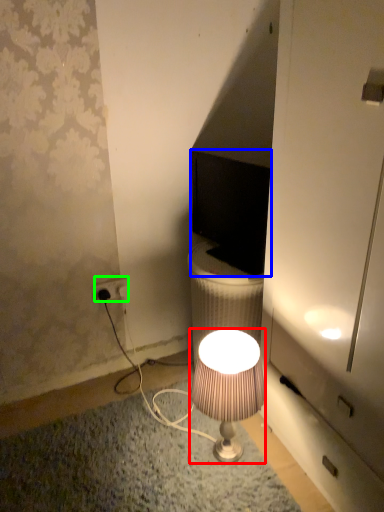
Question: Which object is positioned farthest from lamp (highlighted by a red box)? Select from computer monitor (highlighted by a blue box) and power outlet (highlighted by a green box).

Choices:
 (A) computer monitor
 (B) power outlet

Answer: (B)